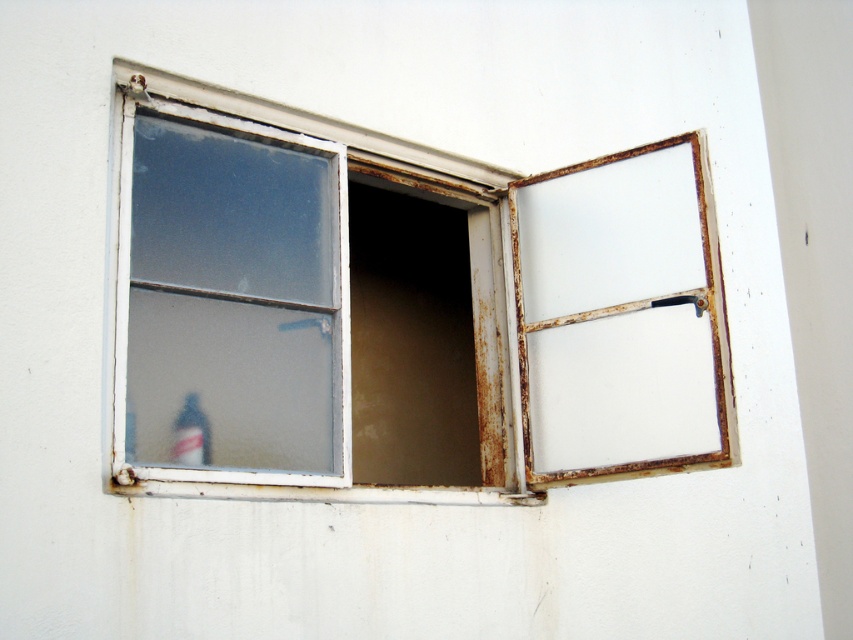
You are standing in front of a building and want to locate the rusty metal window at center. According to the coordinates provided, where exactly should you look?

You should look at point (355, 292) to find the rusty metal window at center.

You are standing 3 meters away from the window shown in the image. There is a point marked at coordinates point (181, 396). Can you reach that point without moving closer to the window?

The distance of point (181, 396) from the camera is 3.25 meters. Since you are currently 3 meters away from the window, you would need to move 0.25 meters further back to reach the point, so you cannot reach it without moving closer.